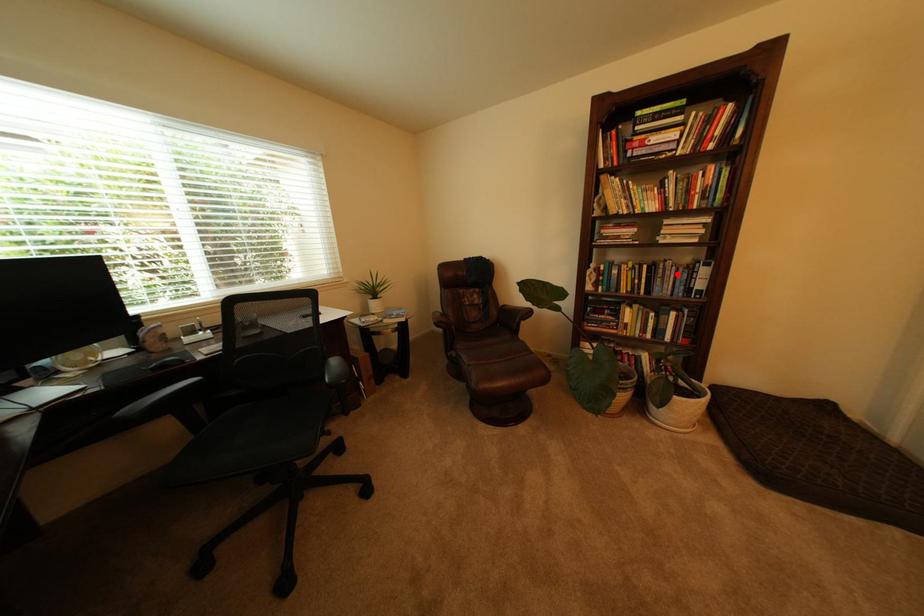
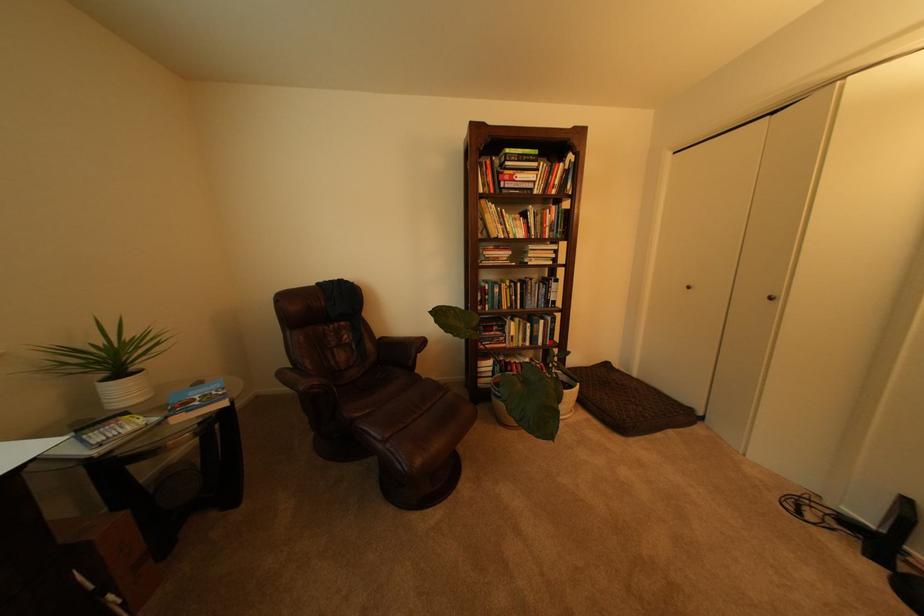
In the second image, find the point that corresponds to the highlighted location in the first image.

(543, 290)